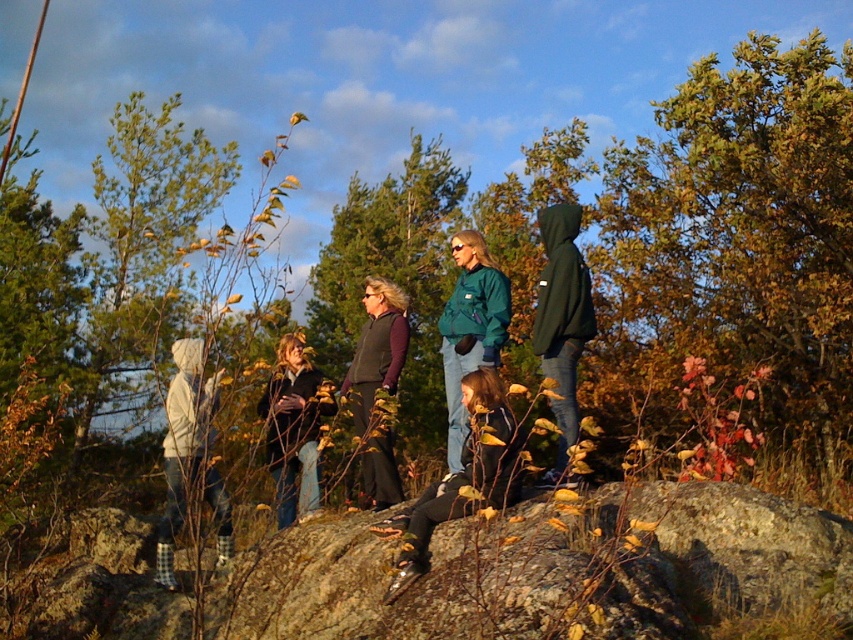
Is brown mossy rock at center to the left of dark green hoodie at center from the viewer's perspective?

Correct, you'll find brown mossy rock at center to the left of dark green hoodie at center.

This screenshot has width=853, height=640. I want to click on brown mossy rock at center, so click(x=550, y=570).

Is dark blue jeans at center bigger than matte black jacket at center?

Indeed, dark blue jeans at center has a larger size compared to matte black jacket at center.

Is dark blue jeans at center to the left of matte black jacket at center from the viewer's perspective?

No, dark blue jeans at center is not to the left of matte black jacket at center.

The width and height of the screenshot is (853, 640). What are the coordinates of `dark blue jeans at center` in the screenshot? It's located at (462, 477).

From the picture: Can you confirm if green matte jacket at center is shorter than matte green jacket at center?

In fact, green matte jacket at center may be taller than matte green jacket at center.

Does green matte jacket at center lie behind matte green jacket at center?

That is False.

Which is behind, point (381, 316) or point (494, 360)?

Point (381, 316)

Where is `green matte jacket at center`? Image resolution: width=853 pixels, height=640 pixels. green matte jacket at center is located at coordinates (469, 332).